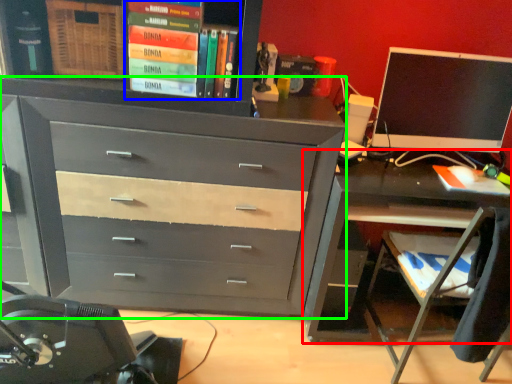
Question: Estimate the real-world distances between objects in this image. Which object is closer to desk (highlighted by a red box), book (highlighted by a blue box) or chest of drawers (highlighted by a green box)?

Choices:
 (A) book
 (B) chest of drawers

Answer: (B)